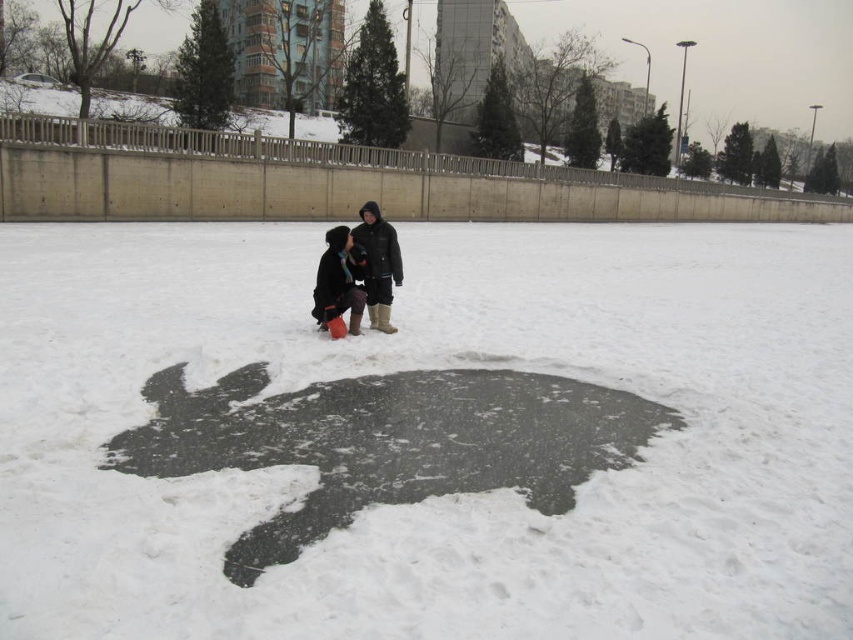
Question: Which point is closer to the camera?

Choices:
 (A) 169,237
 (B) 358,294
 (C) 335,256

Answer: (C)

Question: Which object is positioned farthest from the dark gray woolen coat at center?

Choices:
 (A) dark brown fur coat at center
 (B) black matte snow at center

Answer: (B)

Question: Which object is farther from the camera taking this photo?

Choices:
 (A) black matte snow at center
 (B) dark gray woolen coat at center
 (C) dark brown fur coat at center

Answer: (B)

Question: Does black matte snow at center have a larger size compared to dark gray woolen coat at center?

Choices:
 (A) no
 (B) yes

Answer: (B)

Question: In this image, where is dark gray woolen coat at center located relative to dark brown fur coat at center?

Choices:
 (A) below
 (B) above

Answer: (B)

Question: Does black matte snow at center have a greater width compared to dark brown fur coat at center?

Choices:
 (A) yes
 (B) no

Answer: (A)